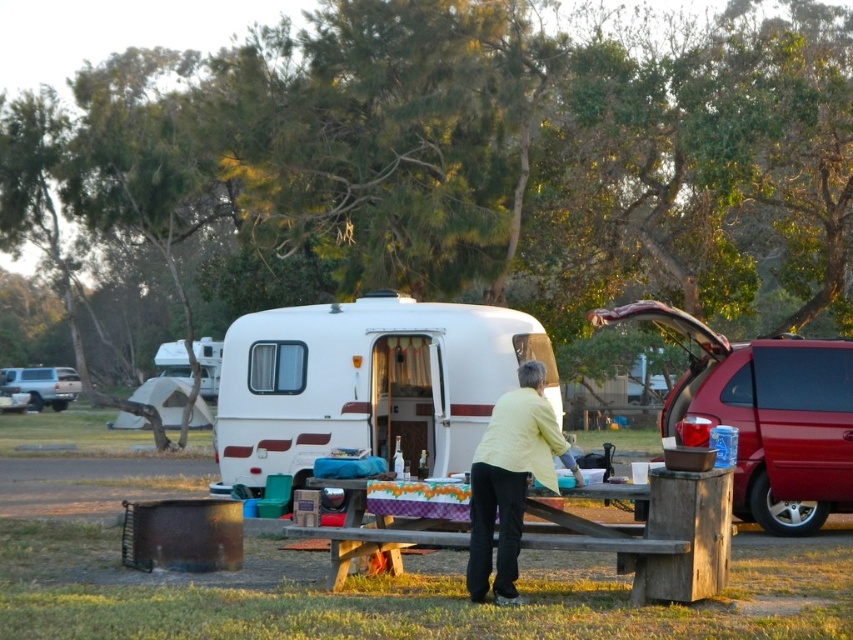
Question: Which point is farther to the camera?

Choices:
 (A) (41, 376)
 (B) (514, 544)
 (C) (386, 520)
 (D) (376, 396)

Answer: (A)

Question: Estimate the real-world distances between objects in this image. Which object is closer to the light yellow fabric at center?

Choices:
 (A) silver metallic suv at left
 (B) wooden picnic table at center

Answer: (B)

Question: Is metallic red van at right wider than wooden picnic table at center?

Choices:
 (A) no
 (B) yes

Answer: (B)

Question: Is white glossy camper at center wider than wooden picnic table at center?

Choices:
 (A) yes
 (B) no

Answer: (A)

Question: Can you confirm if metallic red van at right is wider than silver metallic suv at left?

Choices:
 (A) yes
 (B) no

Answer: (B)

Question: Which of the following is the closest to the observer?

Choices:
 (A) white glossy camper at center
 (B) light yellow fabric at center

Answer: (B)